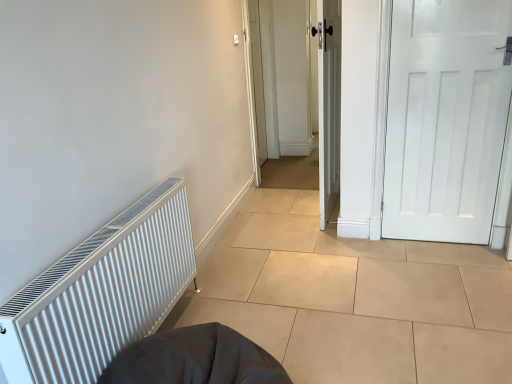
Question: Could you tell me if white matte radiator at left is facing white wooden door at center, the first door from the left?

Choices:
 (A) no
 (B) yes

Answer: (A)

Question: From a real-world perspective, is white matte radiator at left below white wooden door at center, marked as the second door in a right-to-left arrangement?

Choices:
 (A) no
 (B) yes

Answer: (B)

Question: Is white matte radiator at left thinner than white wooden door at center, marked as the second door in a right-to-left arrangement?

Choices:
 (A) yes
 (B) no

Answer: (B)

Question: From a real-world perspective, is white matte radiator at left on white wooden door at center, the first door from the left?

Choices:
 (A) no
 (B) yes

Answer: (A)

Question: Can you confirm if white matte radiator at left is smaller than white wooden door at center, marked as the second door in a right-to-left arrangement?

Choices:
 (A) yes
 (B) no

Answer: (B)

Question: Looking at the image, does white matte door at right, which appears as the 2th door when viewed from the left, seem bigger or smaller compared to white ribbed radiator at left?

Choices:
 (A) small
 (B) big

Answer: (A)

Question: Which is correct: white matte door at right, which appears as the 2th door when viewed from the left, is inside white ribbed radiator at left, or outside of it?

Choices:
 (A) outside
 (B) inside

Answer: (A)

Question: Is white matte door at right, which appears as the 2th door when viewed from the left, wider or thinner than white ribbed radiator at left?

Choices:
 (A) wide
 (B) thin

Answer: (B)

Question: From a real-world perspective, is white matte door at right, arranged as the 1th door when viewed from the right, above or below white ribbed radiator at left?

Choices:
 (A) below
 (B) above

Answer: (B)

Question: Does point (325, 218) appear closer or farther from the camera than point (283, 367)?

Choices:
 (A) closer
 (B) farther

Answer: (B)

Question: From a real-world perspective, relative to dark gray fabric sleeping bag at lower center, is white wooden door at center, the first door from the left, vertically above or below?

Choices:
 (A) above
 (B) below

Answer: (A)

Question: Is white wooden door at center, the first door from the left, inside or outside of dark gray fabric sleeping bag at lower center?

Choices:
 (A) inside
 (B) outside

Answer: (B)

Question: In terms of size, does white wooden door at center, marked as the second door in a right-to-left arrangement, appear bigger or smaller than dark gray fabric sleeping bag at lower center?

Choices:
 (A) big
 (B) small

Answer: (A)

Question: Looking at the image, does dark gray fabric sleeping bag at lower center seem bigger or smaller compared to white wooden door at center, the first door from the left?

Choices:
 (A) small
 (B) big

Answer: (A)

Question: Is dark gray fabric sleeping bag at lower center spatially inside white wooden door at center, the first door from the left, or outside of it?

Choices:
 (A) outside
 (B) inside

Answer: (A)